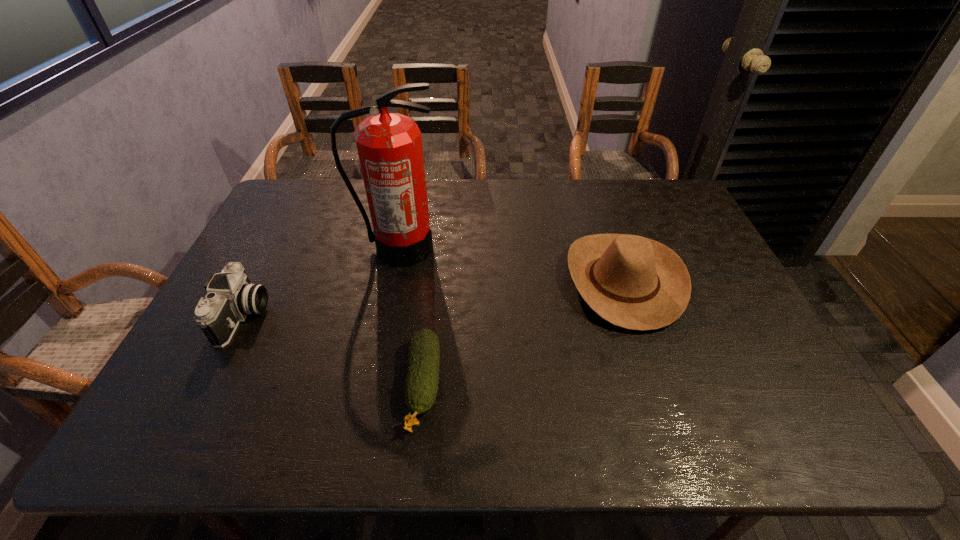
Locate an element on the screen. free space that satisfies the following two spatial constraints: 1. on the front-facing side of the cowboy hat; 2. at the blossom end of the cucumber is located at coordinates (658, 385).